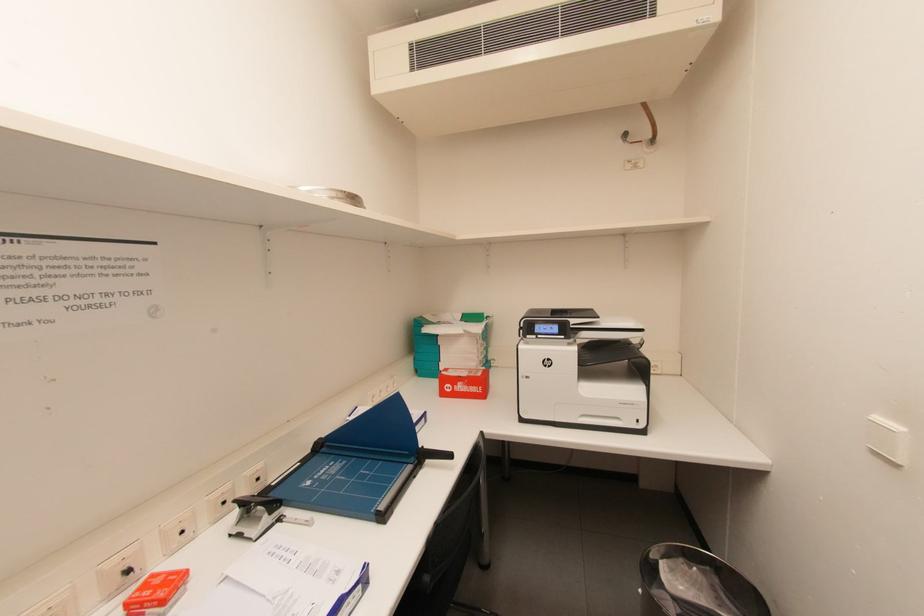
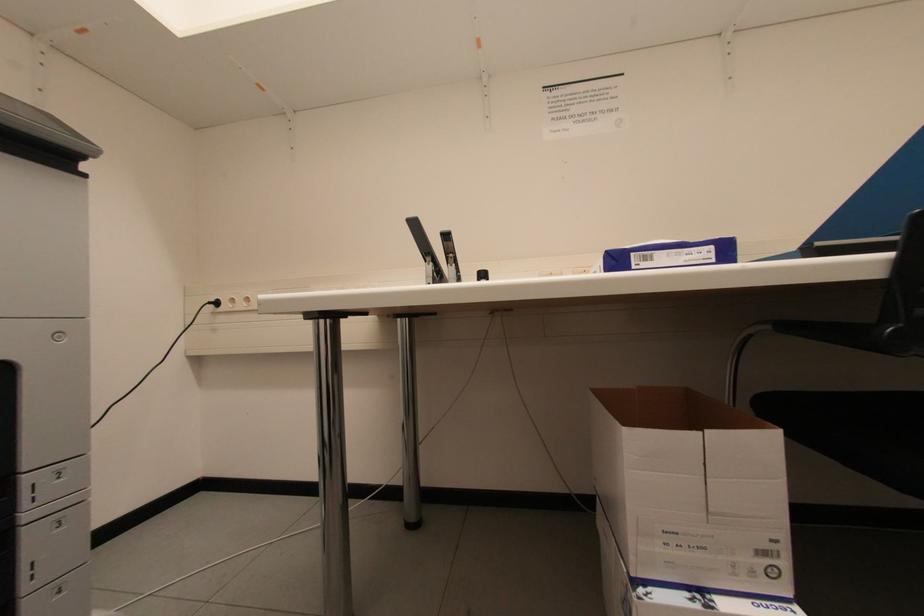
Question: How did the camera likely rotate?

Choices:
 (A) Left
 (B) Right
 (C) Up
 (D) Down

Answer: (A)